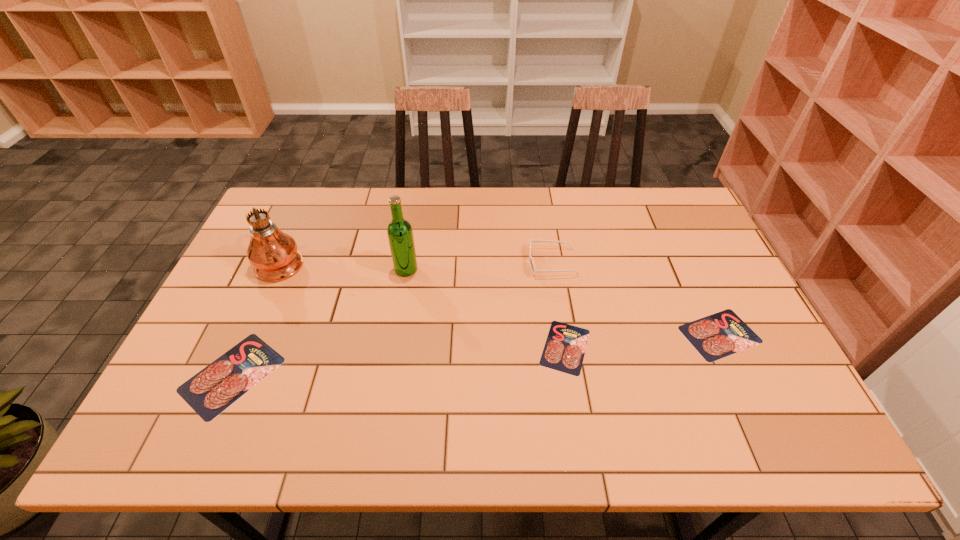
Locate an element on the screen. vacant space situated 0.100m on the back of the second salami from right to left is located at coordinates (557, 293).

Image resolution: width=960 pixels, height=540 pixels. Find the location of `free space located 0.290m on the left of the rightmost salami`. free space located 0.290m on the left of the rightmost salami is located at coordinates (569, 334).

This screenshot has width=960, height=540. I want to click on vacant space situated 0.400m on the front of the second tallest object, so click(x=384, y=402).

Where is `vacant region located with the lenses of the sunglasses facing outward`? The height and width of the screenshot is (540, 960). vacant region located with the lenses of the sunglasses facing outward is located at coordinates (499, 262).

Identify the location of free space located 0.070m with the lenses of the sunglasses facing outward. (505, 262).

The height and width of the screenshot is (540, 960). I want to click on blank space located with the lenses of the sunglasses facing outward, so click(x=459, y=262).

I want to click on vacant space situated 0.200m on the front of the tallest object, so click(x=246, y=339).

The width and height of the screenshot is (960, 540). In order to click on salami that is at the left edge in this screenshot , I will do `click(212, 390)`.

Where is `oil lamp that is at the left edge`? Image resolution: width=960 pixels, height=540 pixels. oil lamp that is at the left edge is located at coordinates (273, 253).

Identify the location of object that is at the right edge. (716, 336).